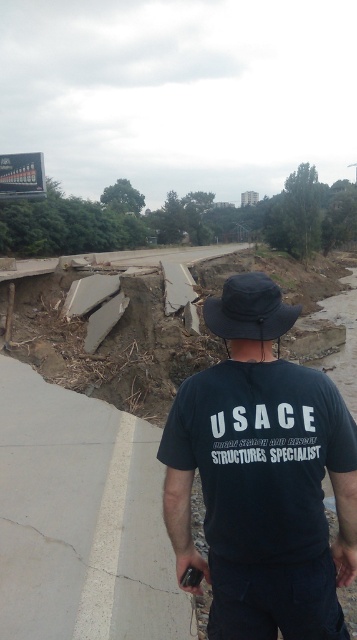
Question: Which of the following is the closest to the observer?

Choices:
 (A) (103, 598)
 (B) (242, 324)

Answer: (B)

Question: Which point is farther to the camera?

Choices:
 (A) black fabric baseball hat at center
 (B) dark blue cotton shirt at center
 (C) gray concrete pavement at lower left

Answer: (C)

Question: In this image, where is dark blue cotton shirt at center located relative to black fabric baseball hat at center?

Choices:
 (A) above
 (B) below

Answer: (B)

Question: Where is dark blue cotton shirt at center located in relation to gray concrete pavement at lower left in the image?

Choices:
 (A) below
 (B) above

Answer: (B)

Question: Which object appears closest to the camera in this image?

Choices:
 (A) black fabric baseball hat at center
 (B) dark blue cotton shirt at center
 (C) gray concrete pavement at lower left

Answer: (B)

Question: In this image, where is gray concrete pavement at lower left located relative to black fabric baseball hat at center?

Choices:
 (A) below
 (B) above

Answer: (A)